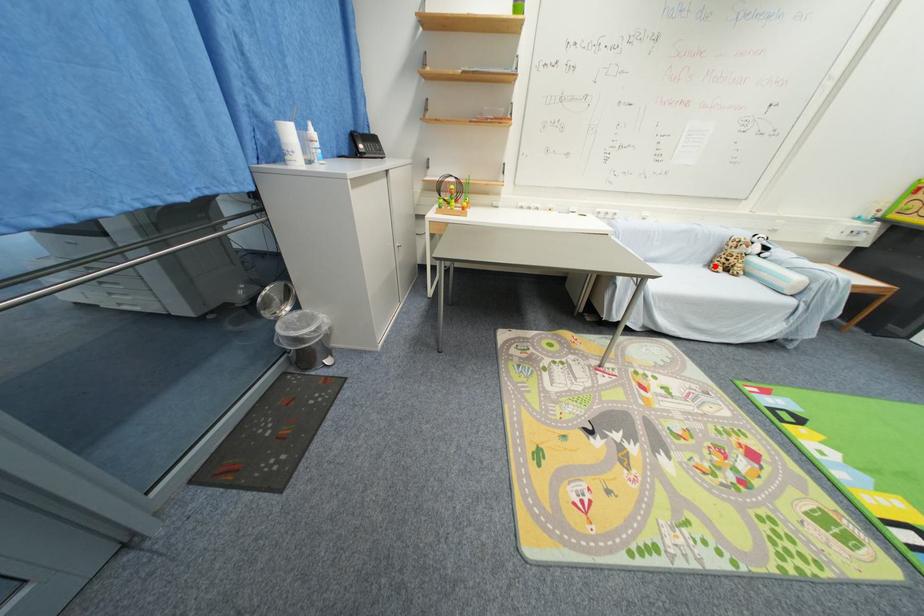
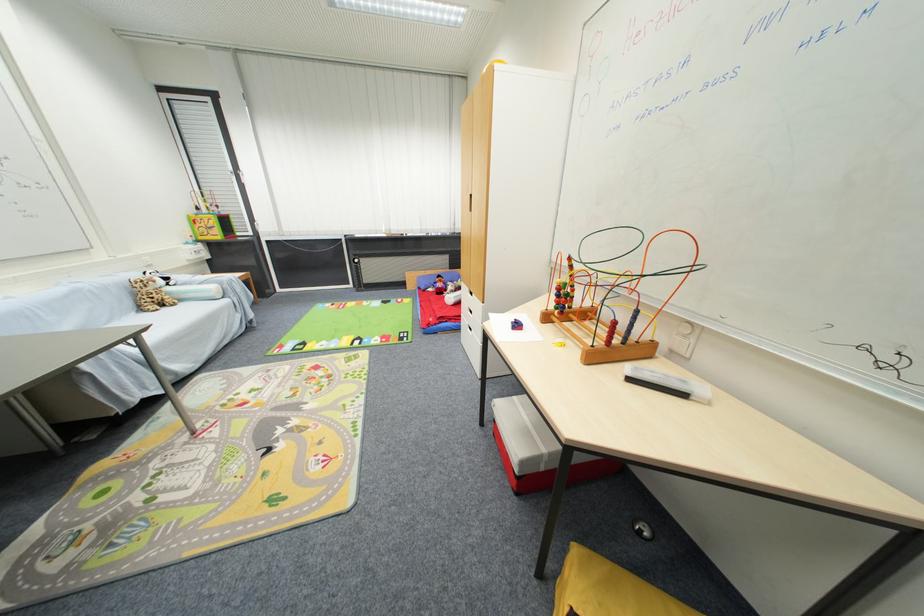
Find the pixel in the second image that matches the highlighted location in the first image.

(146, 310)